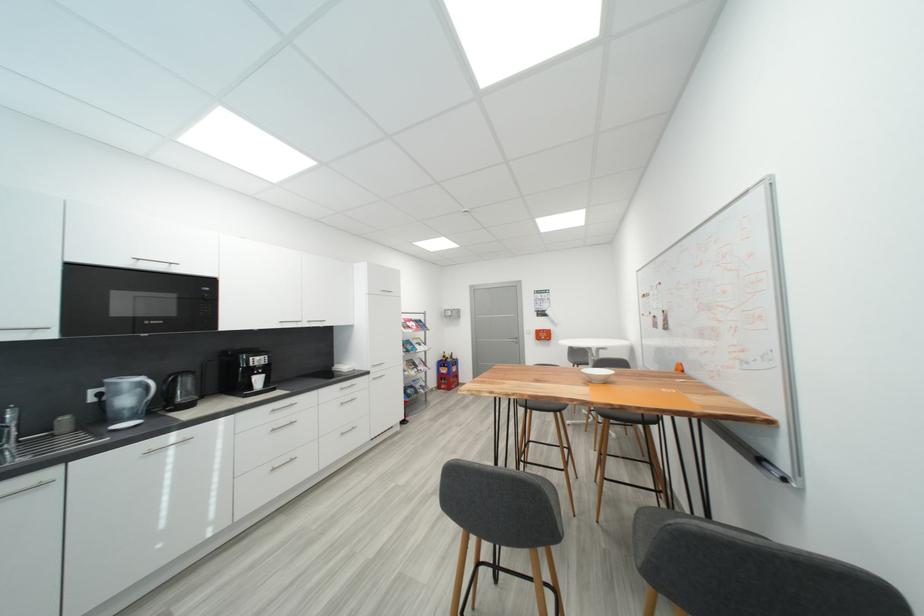
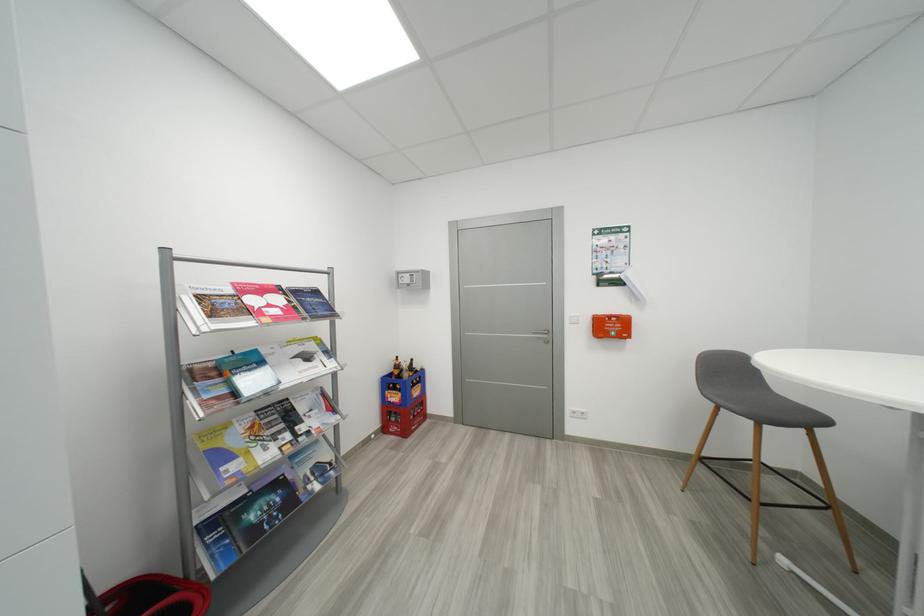
Find the pixel in the second image that matches [456,315] in the first image.

(412, 282)